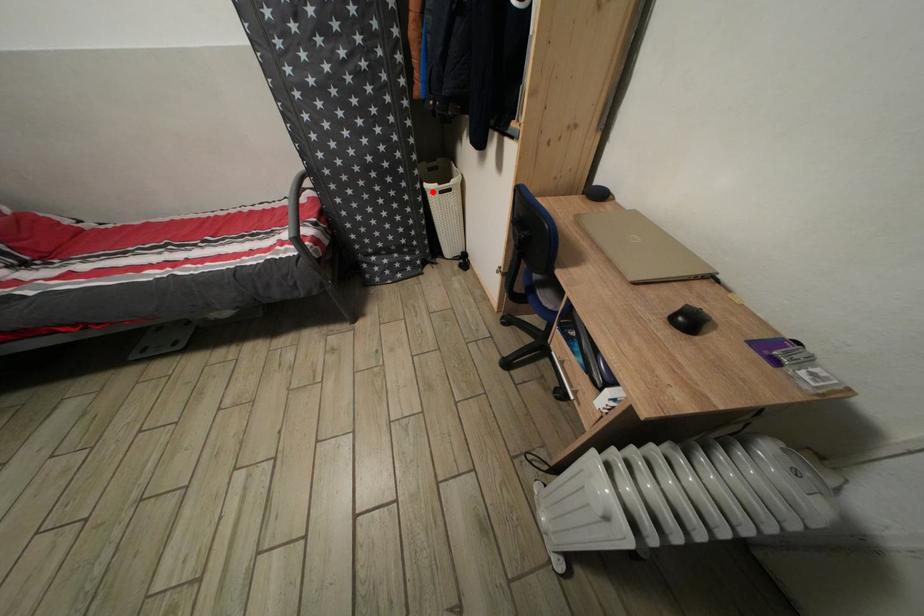
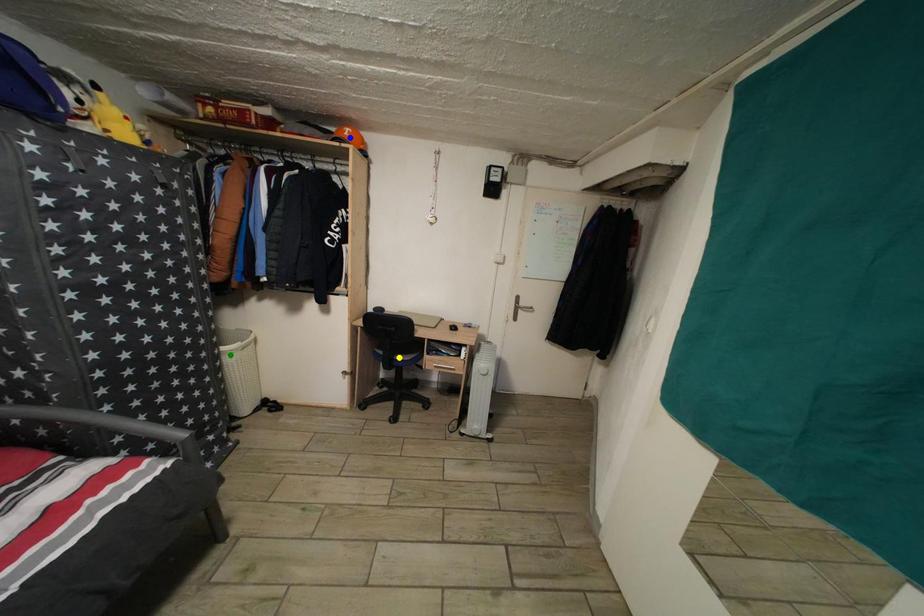
Question: I am providing you with two images of the same scene from different viewpoints. A red point is marked on the first image. You are given multiple points on the second image. In image 2, which mark is for the same physical point as the one in image 1?

Choices:
 (A) yellow point
 (B) green point
 (C) blue point

Answer: (B)